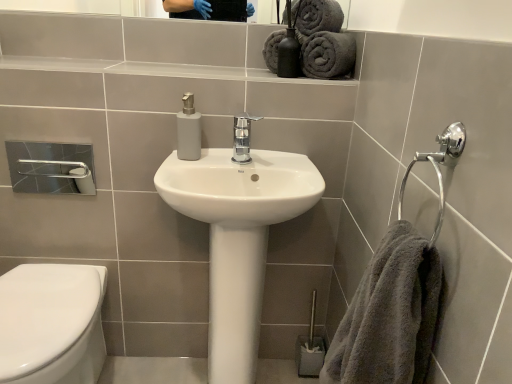
In order to face white glossy toilet at lower left, should I rotate leftwards or rightwards?

To align with it, rotate left about 27.400°.

The image size is (512, 384). Identify the location of gray fluffy towel at upper right, arranged as the first bath towel when viewed from the left. (323, 39).

Where is `gray fluffy towel at right`? The height and width of the screenshot is (384, 512). gray fluffy towel at right is located at coordinates (390, 315).

Where is `chrome metallic faucet at center`? The height and width of the screenshot is (384, 512). chrome metallic faucet at center is located at coordinates (242, 137).

Describe the element at coordinates (242, 137) in the screenshot. Image resolution: width=512 pixels, height=384 pixels. I see `chrome metallic faucet at center` at that location.

Image resolution: width=512 pixels, height=384 pixels. Identify the location of white glossy sink at center. (238, 238).

Describe the element at coordinates (88, 7) in the screenshot. I see `clear glass mirror at upper center` at that location.

Identify the location of matte gray soap dispenser at center. (188, 130).

Find the location of a particular element. Image resolution: width=512 pixels, height=384 pixels. white glossy toilet at lower left is located at coordinates coord(52,323).

Considering the sizes of objects gray fluffy towel at upper right, arranged as the first bath towel when viewed from the left, and gray fluffy towel at right in the image provided, who is smaller, gray fluffy towel at upper right, arranged as the first bath towel when viewed from the left, or gray fluffy towel at right?

gray fluffy towel at upper right, arranged as the first bath towel when viewed from the left.

From the image's perspective, which is above, gray fluffy towel at upper right, which ranks as the second bath towel in right-to-left order, or gray fluffy towel at right?

gray fluffy towel at upper right, which ranks as the second bath towel in right-to-left order.

Between gray fluffy towel at upper right, which ranks as the second bath towel in right-to-left order, and gray fluffy towel at right, which one has larger width?

gray fluffy towel at right.

Is gray fluffy towel at upper right, which ranks as the second bath towel in right-to-left order, oriented away from gray fluffy towel at right?

That's not correct — gray fluffy towel at upper right, which ranks as the second bath towel in right-to-left order, is not looking away from gray fluffy towel at right.

Considering their positions, is metallic silver toilet brush at lower right located in front of or behind white glossy sink at center?

Visually, metallic silver toilet brush at lower right is located behind white glossy sink at center.

Looking at this image, is metallic silver toilet brush at lower right at the right side of white glossy sink at center?

Indeed, metallic silver toilet brush at lower right is positioned on the right side of white glossy sink at center.

Is metallic silver toilet brush at lower right bigger than white glossy sink at center?

No, metallic silver toilet brush at lower right is not bigger than white glossy sink at center.

From a real-world perspective, is metallic silver toilet brush at lower right positioned above or below white glossy sink at center?

From a real-world perspective, metallic silver toilet brush at lower right is physically below white glossy sink at center.

Which is in front, point (184, 139) or point (413, 343)?

Positioned in front is point (413, 343).

Is matte gray soap dispenser at center located outside gray fluffy towel at right?

Yes, matte gray soap dispenser at center is outside of gray fluffy towel at right.

Who is more distant, matte gray soap dispenser at center or gray fluffy towel at right?

matte gray soap dispenser at center is further from the camera.

Considering the positions of objects matte gray soap dispenser at center and gray fluffy towel at right in the image provided, who is more to the left, matte gray soap dispenser at center or gray fluffy towel at right?

matte gray soap dispenser at center is more to the left.

Which object is closer to the camera taking this photo, matte gray soap dispenser at center or dark gray plush towels at upper right, acting as the first bath towel starting from the right?

matte gray soap dispenser at center is in front.

Image resolution: width=512 pixels, height=384 pixels. Identify the location of soap dispenser that appears on the left of dark gray plush towels at upper right, acting as the first bath towel starting from the right. (188, 130).

Which is more to the left, matte gray soap dispenser at center or dark gray plush towels at upper right, acting as the first bath towel starting from the right?

matte gray soap dispenser at center.

From the image's perspective, who appears lower, matte gray soap dispenser at center or dark gray plush towels at upper right, arranged as the second bath towel when viewed from the left?

matte gray soap dispenser at center.

Considering the sizes of objects chrome metallic faucet at center and white glossy toilet at lower left in the image provided, who is bigger, chrome metallic faucet at center or white glossy toilet at lower left?

With larger size is white glossy toilet at lower left.

From a real-world perspective, is chrome metallic faucet at center positioned under white glossy toilet at lower left based on gravity?

No.

You are a GUI agent. You are given a task and a screenshot of the screen. Output one action in this format:
    pyautogui.click(x=<x>, y=<y>)
    Task: Click on the tap above the white glossy toilet at lower left (from the image's perspective)
    The width and height of the screenshot is (512, 384).
    Given the screenshot: What is the action you would take?
    pyautogui.click(x=242, y=137)

Is matte gray soap dispenser at center turned away from chrome metallic faucet at center?

No.

The image size is (512, 384). I want to click on soap dispenser that appears above the chrome metallic faucet at center (from the image's perspective), so click(188, 130).

Between matte gray soap dispenser at center and chrome metallic faucet at center, which one is positioned in front?

chrome metallic faucet at center is more forward.

In the scene shown: Are gray fluffy towel at right and clear glass mirror at upper center making contact?

There is a gap between gray fluffy towel at right and clear glass mirror at upper center.

Considering the relative sizes of gray fluffy towel at right and clear glass mirror at upper center in the image provided, is gray fluffy towel at right shorter than clear glass mirror at upper center?

In fact, gray fluffy towel at right may be taller than clear glass mirror at upper center.

From the image's perspective, is gray fluffy towel at right below clear glass mirror at upper center?

Indeed, from the image's perspective, gray fluffy towel at right is shown beneath clear glass mirror at upper center.

Based on the photo, which is more to the left, gray fluffy towel at right or clear glass mirror at upper center?

From the viewer's perspective, clear glass mirror at upper center appears more on the left side.

You are a GUI agent. You are given a task and a screenshot of the screen. Output one action in this format:
    pyautogui.click(x=<x>, y=<y>)
    Task: Click on the towel below the gray fluffy towel at upper right, which ranks as the second bath towel in right-to-left order (from the image's perspective)
    The height and width of the screenshot is (384, 512).
    Given the screenshot: What is the action you would take?
    pyautogui.click(x=390, y=315)

The width and height of the screenshot is (512, 384). I want to click on sink located above the metallic silver toilet brush at lower right (from the image's perspective), so click(x=238, y=238).

From the image, which object appears to be farther from metallic silver toilet brush at lower right, chrome metallic faucet at center or clear glass mirror at upper center?

clear glass mirror at upper center lies further to metallic silver toilet brush at lower right than the other object.

From the image, which object appears to be farther from metallic silver toilet brush at lower right, gray fluffy towel at right or white glossy sink at center?

gray fluffy towel at right lies further to metallic silver toilet brush at lower right than the other object.

In the scene shown: From the image, which object appears to be farther from gray fluffy towel at right, white glossy sink at center or matte gray soap dispenser at center?

matte gray soap dispenser at center is further to gray fluffy towel at right.

Estimate the real-world distances between objects in this image. Which object is closer to dark gray plush towels at upper right, arranged as the second bath towel when viewed from the left, gray fluffy towel at upper right, which ranks as the second bath towel in right-to-left order, or gray fluffy towel at right?

gray fluffy towel at upper right, which ranks as the second bath towel in right-to-left order, is closer to dark gray plush towels at upper right, arranged as the second bath towel when viewed from the left.

Estimate the real-world distances between objects in this image. Which object is closer to gray fluffy towel at upper right, which ranks as the second bath towel in right-to-left order, white glossy toilet at lower left or chrome metallic faucet at center?

chrome metallic faucet at center is closer to gray fluffy towel at upper right, which ranks as the second bath towel in right-to-left order.

Estimate the real-world distances between objects in this image. Which object is further from gray fluffy towel at upper right, which ranks as the second bath towel in right-to-left order, dark gray plush towels at upper right, arranged as the second bath towel when viewed from the left, or chrome metallic faucet at center?

Based on the image, chrome metallic faucet at center appears to be further to gray fluffy towel at upper right, which ranks as the second bath towel in right-to-left order.

Based on their spatial positions, is gray fluffy towel at upper right, arranged as the first bath towel when viewed from the left, or dark gray plush towels at upper right, arranged as the second bath towel when viewed from the left, further from white glossy toilet at lower left?

Based on the image, dark gray plush towels at upper right, arranged as the second bath towel when viewed from the left, appears to be further to white glossy toilet at lower left.

When comparing their distances from metallic silver toilet brush at lower right, does gray fluffy towel at upper right, arranged as the first bath towel when viewed from the left, or chrome metallic faucet at center seem further?

gray fluffy towel at upper right, arranged as the first bath towel when viewed from the left.

The image size is (512, 384). What are the coordinates of `bath towel between matte gray soap dispenser at center and dark gray plush towels at upper right, acting as the first bath towel starting from the right, in the horizontal direction` in the screenshot? It's located at (323, 39).

I want to click on tap between dark gray plush towels at upper right, arranged as the second bath towel when viewed from the left, and gray fluffy towel at right, in the vertical direction, so click(x=242, y=137).

Locate an element on the screen. The width and height of the screenshot is (512, 384). tap that lies between gray fluffy towel at upper right, which ranks as the second bath towel in right-to-left order, and white glossy toilet at lower left from top to bottom is located at coordinates (242, 137).

You are a GUI agent. You are given a task and a screenshot of the screen. Output one action in this format:
    pyautogui.click(x=<x>, y=<y>)
    Task: Click on the soap dispenser that lies between clear glass mirror at upper center and chrome metallic faucet at center from top to bottom
    This screenshot has height=384, width=512.
    Given the screenshot: What is the action you would take?
    pyautogui.click(x=188, y=130)